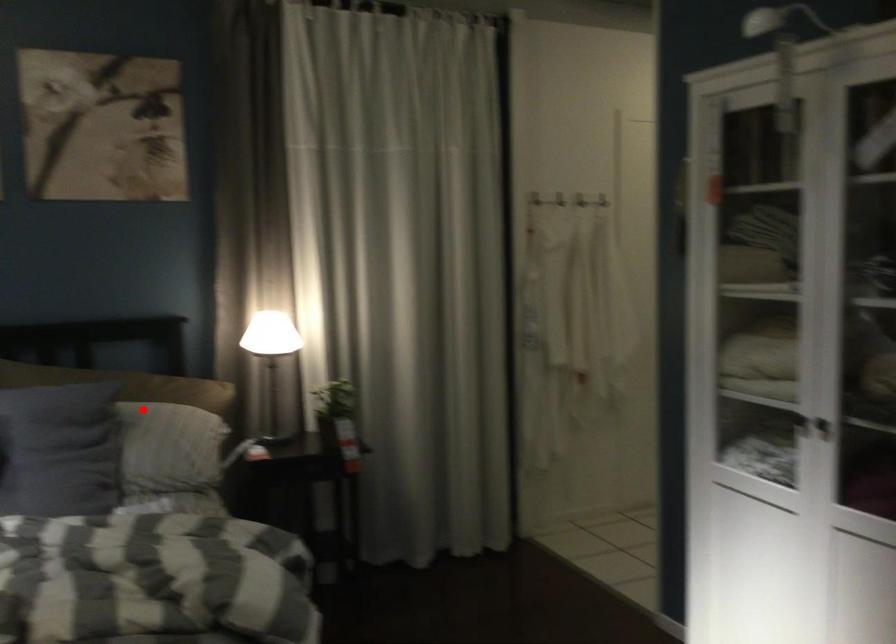
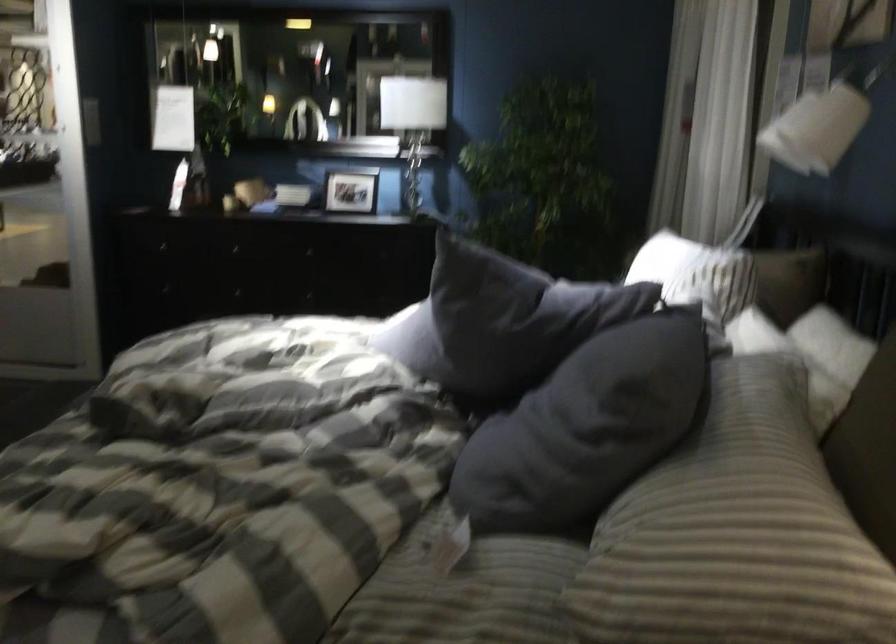
Find the pixel in the second image that matches the highlighted location in the first image.

(760, 453)